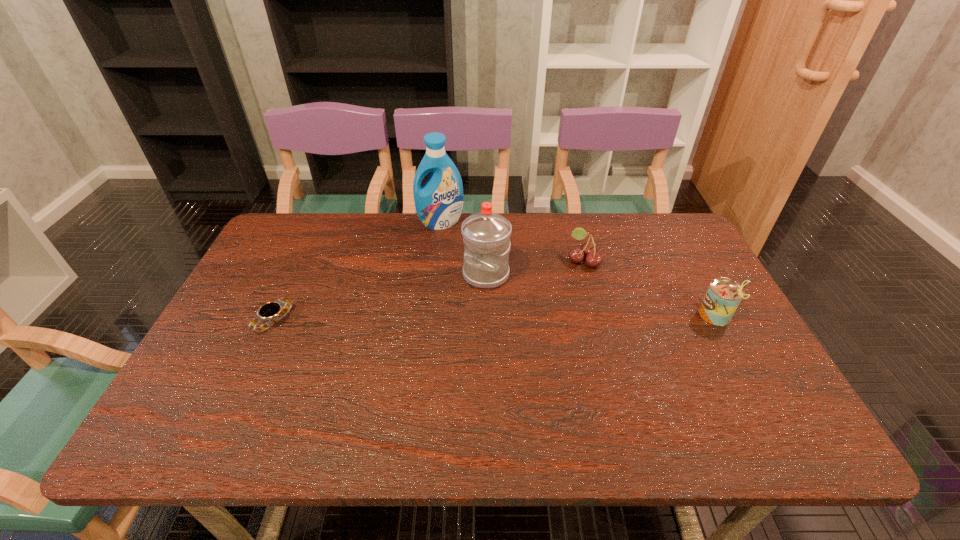
Locate an element on the screen. the leftmost object is located at coordinates (274, 311).

Locate an element on the screen. the shortest object is located at coordinates (274, 311).

This screenshot has height=540, width=960. What are the coordinates of `the rightmost object` in the screenshot? It's located at (724, 295).

Image resolution: width=960 pixels, height=540 pixels. I want to click on can, so click(724, 295).

Identify the location of the tallest object. Image resolution: width=960 pixels, height=540 pixels. (439, 202).

I want to click on the farthest object, so click(439, 202).

Where is `the fourth object from left to right`? Image resolution: width=960 pixels, height=540 pixels. the fourth object from left to right is located at coordinates (588, 249).

Identify the location of the fourth tallest object. The image size is (960, 540). (588, 249).

The image size is (960, 540). Identify the location of the third object from right to left. (486, 234).

Find the location of a particular element. water bottle is located at coordinates (486, 234).